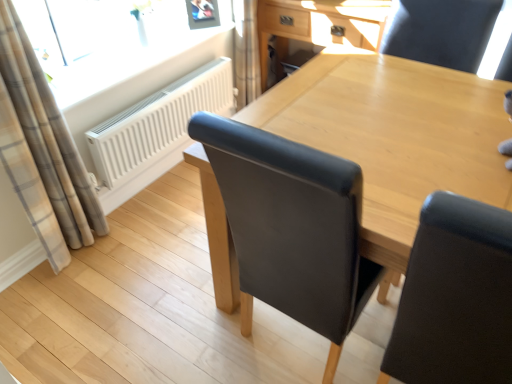
Question: From a real-world perspective, is light brown wood table at center beneath transparent glass window at upper left?

Choices:
 (A) no
 (B) yes

Answer: (B)

Question: Is light brown wood table at center not within transparent glass window at upper left?

Choices:
 (A) no
 (B) yes

Answer: (B)

Question: From the image's perspective, is light brown wood table at center on transparent glass window at upper left?

Choices:
 (A) no
 (B) yes

Answer: (A)

Question: From a real-world perspective, is light brown wood table at center physically above transparent glass window at upper left?

Choices:
 (A) yes
 (B) no

Answer: (B)

Question: Can transparent glass window at upper left be found inside light brown wood table at center?

Choices:
 (A) yes
 (B) no

Answer: (B)

Question: Is light brown wood table at center touching transparent glass window at upper left?

Choices:
 (A) yes
 (B) no

Answer: (B)

Question: From the image's perspective, is white matte radiator at upper left on top of light brown wood table at center?

Choices:
 (A) yes
 (B) no

Answer: (A)

Question: From a real-world perspective, does white matte radiator at upper left sit lower than light brown wood table at center?

Choices:
 (A) no
 (B) yes

Answer: (B)

Question: Is white matte radiator at upper left at the right side of light brown wood table at center?

Choices:
 (A) no
 (B) yes

Answer: (A)

Question: Is white matte radiator at upper left smaller than light brown wood table at center?

Choices:
 (A) yes
 (B) no

Answer: (A)

Question: Is white matte radiator at upper left closer to camera compared to light brown wood table at center?

Choices:
 (A) yes
 (B) no

Answer: (B)

Question: Can you confirm if white matte radiator at upper left is bigger than light brown wood table at center?

Choices:
 (A) yes
 (B) no

Answer: (B)

Question: From the image's perspective, does white matte radiator at upper left appear higher than black leather chair at upper right?

Choices:
 (A) yes
 (B) no

Answer: (A)